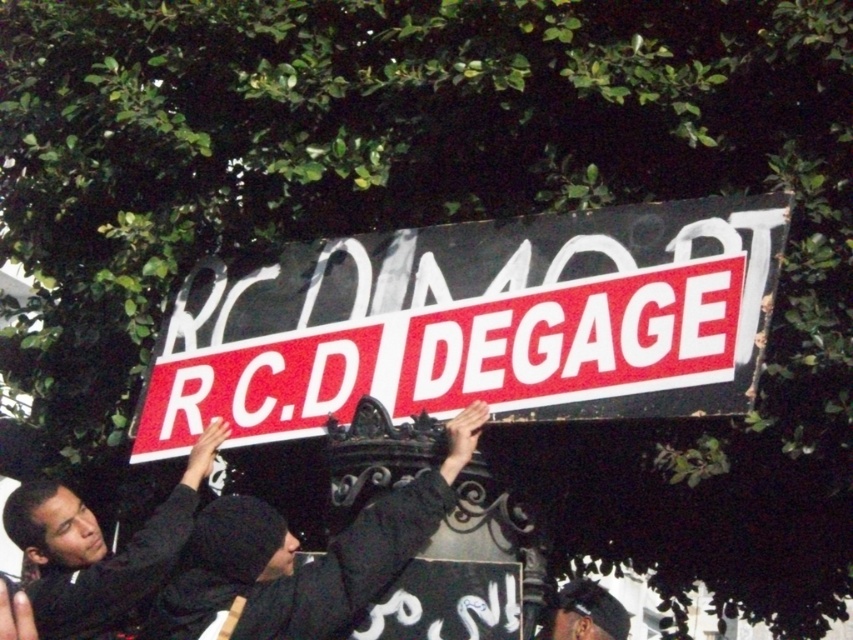
Is red plastic sign at center smaller than black matte clothing at center?

Actually, red plastic sign at center might be larger than black matte clothing at center.

Does point (744, 282) lie in front of point (276, 593)?

That is True.

Who is more forward, (506, 381) or (352, 557)?

Point (352, 557) is in front.

Locate an element on the screen. red plastic sign at center is located at coordinates (476, 323).

Is black matte shirt at center thinner than dark gray knit cap at center?

No.

Measure the distance between point (x=219, y=419) and camera.

Point (x=219, y=419) is 53.32 meters from camera.

Who is more distant from viewer, (57, 518) or (566, 618)?

The point (566, 618) is behind.

At what (x,y) coordinates should I click in order to perform the action: click on black matte shirt at center. Please return your answer as a coordinate pair (x, y). Looking at the image, I should click on (100, 548).

Which of these two, black matte clothing at center or dark gray knit cap at center, stands shorter?

With less height is dark gray knit cap at center.

This screenshot has height=640, width=853. What do you see at coordinates (305, 564) in the screenshot?
I see `black matte clothing at center` at bounding box center [305, 564].

Is point (207, 630) less distant than point (613, 634)?

That is True.

Identify the location of black matte clothing at center. This screenshot has height=640, width=853. (305, 564).